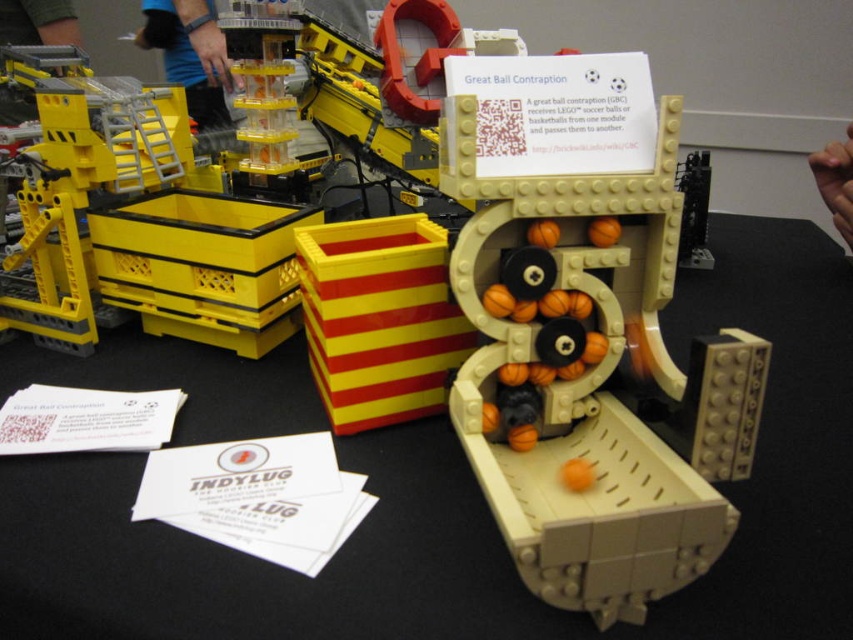
Question: Among these objects, which one is nearest to the camera?

Choices:
 (A) beige plastic ball pit at center
 (B) beige plastic table at center

Answer: (A)

Question: Which point appears farthest from the camera in this image?

Choices:
 (A) (550, 452)
 (B) (102, 371)

Answer: (B)

Question: Considering the real-world distances, which object is farthest from the beige plastic ball pit at center?

Choices:
 (A) beige plastic table at center
 (B) yellow plastic container at left

Answer: (B)

Question: Is beige plastic table at center smaller than beige plastic ball pit at center?

Choices:
 (A) yes
 (B) no

Answer: (B)

Question: Does beige plastic table at center appear under yellow plastic container at left?

Choices:
 (A) yes
 (B) no

Answer: (A)

Question: Can you confirm if beige plastic table at center is wider than yellow plastic container at left?

Choices:
 (A) yes
 (B) no

Answer: (A)